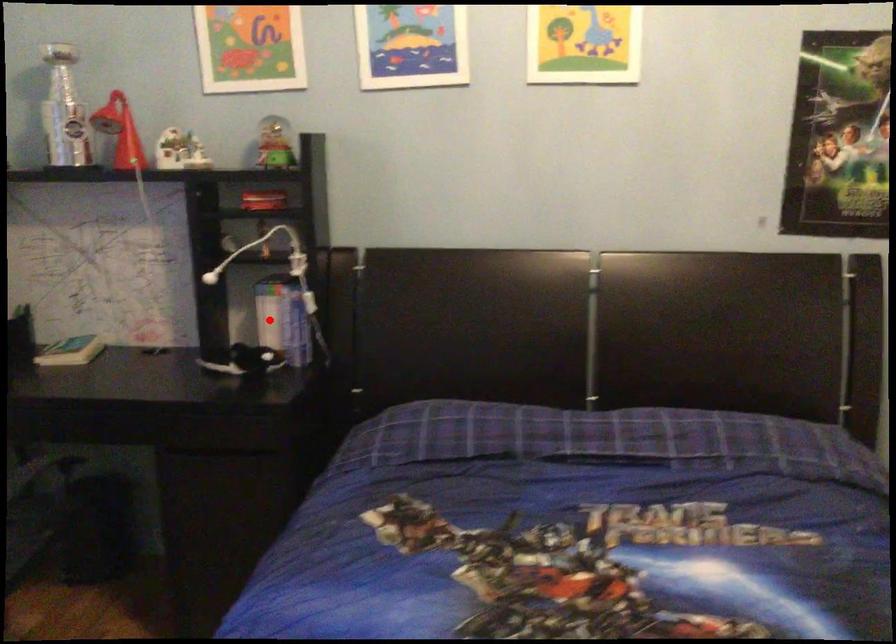
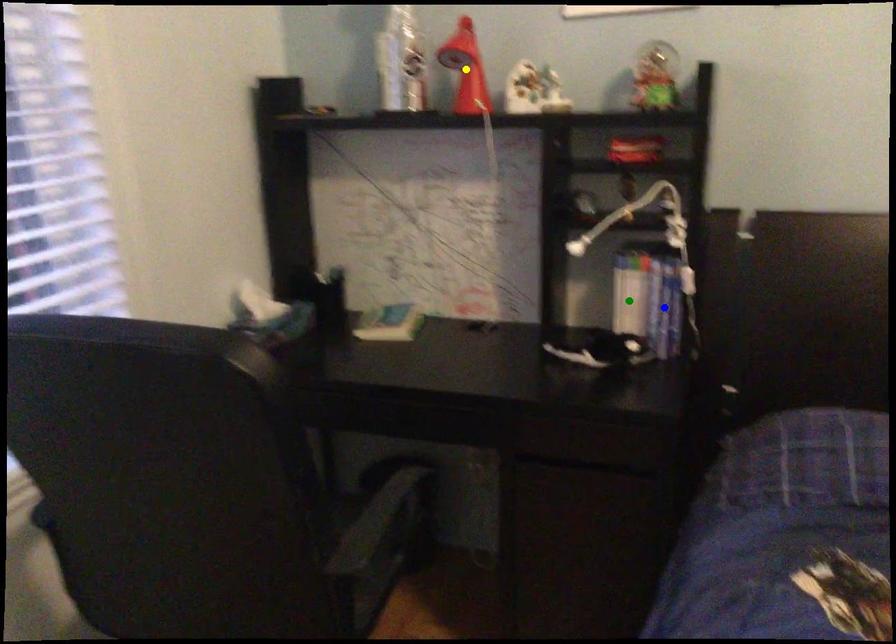
Question: I am providing you with two images of the same scene from different viewpoints. A red point is marked on the first image. You are given multiple points on the second image. Which mark in image 2 goes with the point in image 1?

Choices:
 (A) green point
 (B) blue point
 (C) yellow point

Answer: (A)